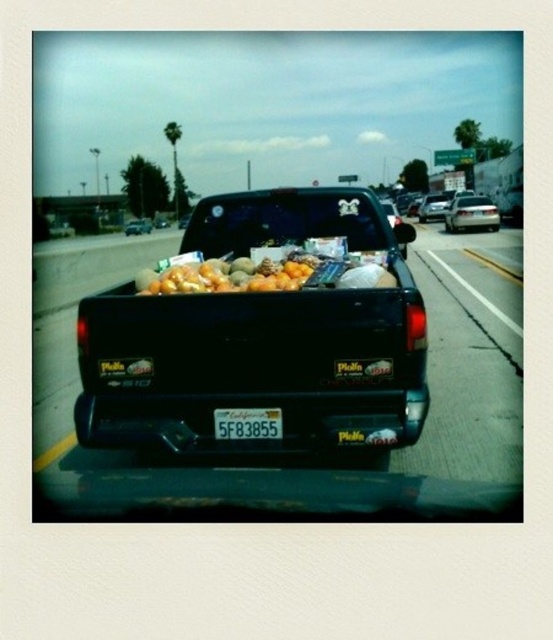
You are a driver in a car behind the black Chevrolet pickup truck. You want to read the license plate number to report an issue. Can you see the white plastic license plate at center clearly from behind the black matte truck bed at center?

The white plastic license plate at center is behind the black matte truck bed at center, so it cannot be seen clearly from behind.

You are a passenger in the truck and want to know which of the two points, point (388, 298) or point (251, 285), is closer to you. Based on the scene, can you determine which point is nearer?

Point (388, 298) is closer to the viewer than point (251, 285).